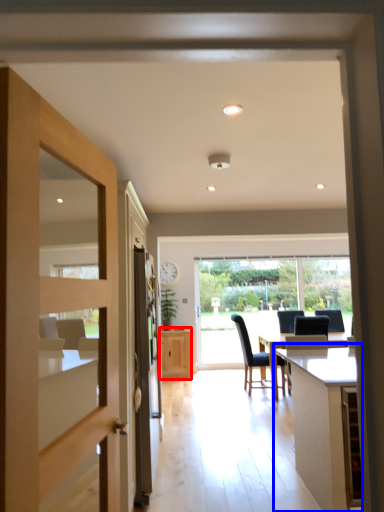
Question: Which object appears farthest to the camera in this image, cabinetry (highlighted by a red box) or table (highlighted by a blue box)?

Choices:
 (A) cabinetry
 (B) table

Answer: (A)